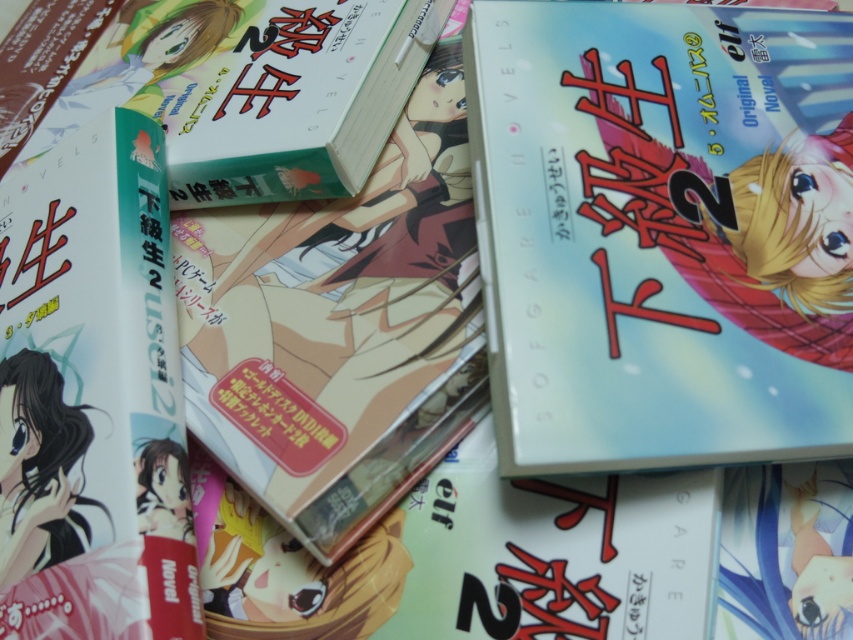
Question: Estimate the real-world distances between objects in this image. Which object is closer to the matte blue novel at center?

Choices:
 (A) hardcover novel at left
 (B) hardcover book at upper left

Answer: (B)

Question: Among these objects, which one is farthest from the camera?

Choices:
 (A) matte blue novel at center
 (B) hardcover novel at left

Answer: (A)

Question: Is matte blue novel at center bigger than hardcover novel at left?

Choices:
 (A) yes
 (B) no

Answer: (A)

Question: Is hardcover novel at left bigger than hardcover book at upper left?

Choices:
 (A) yes
 (B) no

Answer: (A)

Question: Is matte blue novel at center smaller than hardcover novel at left?

Choices:
 (A) no
 (B) yes

Answer: (A)

Question: Which point is closer to the camera?

Choices:
 (A) (74, 573)
 (B) (387, 29)

Answer: (A)